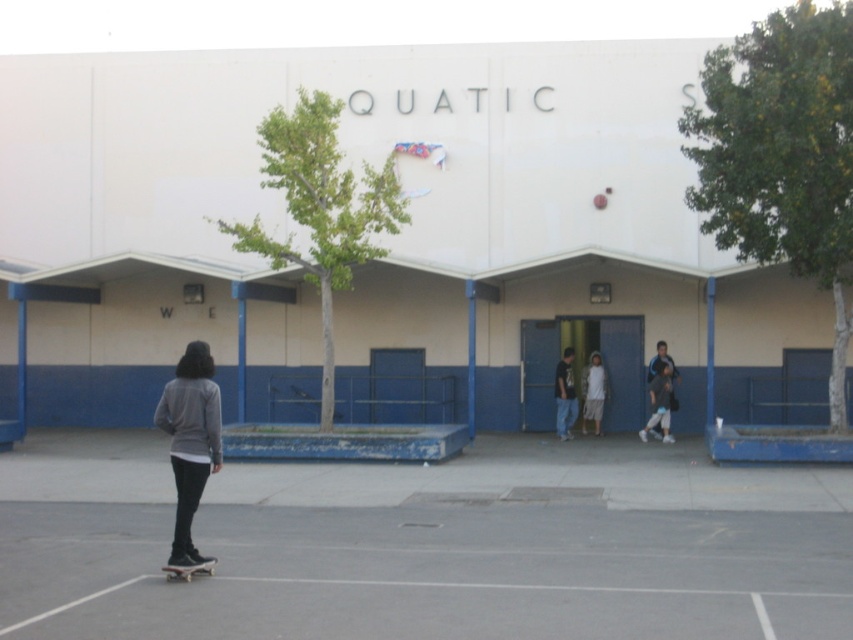
You are standing at the entrance of the QUATIC building and want to know the position of the dark blue jeans at center. What are their coordinates?

The dark blue jeans at center are located at coordinates point (564, 394).

You are a photographer trying to capture the building with the QUATIC sign. You notice a black matte skateboard at lower left and light blue jeans at center in the foreground. Which object is narrower when viewed from your camera angle?

The black matte skateboard at lower left is thinner than the light blue jeans at center, so the skateboard is narrower.